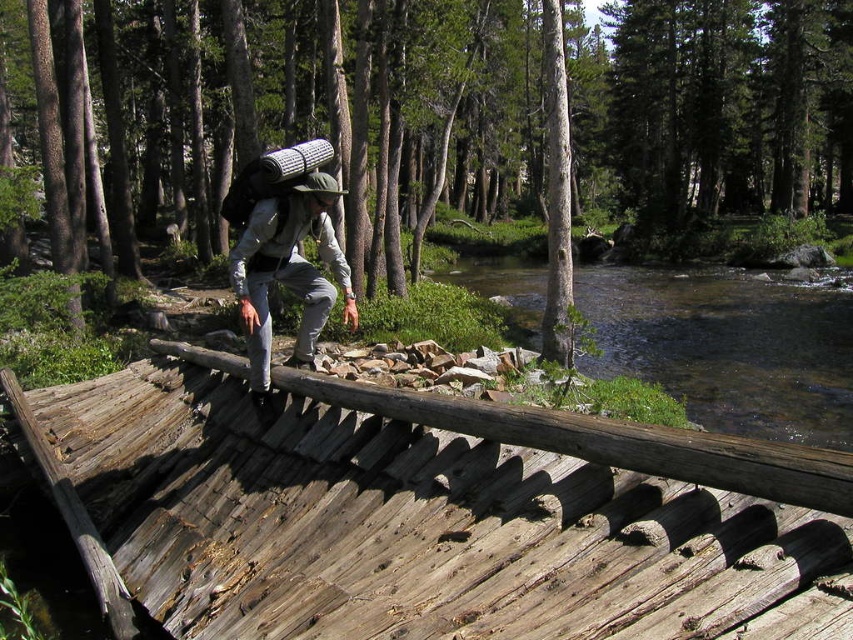
Question: Among these objects, which one is farthest from the camera?

Choices:
 (A) green matte forest at center
 (B) clear water at river right
 (C) gray fabric backpack at center
 (D) weathered wood bridge at center

Answer: (A)

Question: Which is nearer to the weathered wood bridge at center?

Choices:
 (A) gray fabric backpack at center
 (B) green matte forest at center
 (C) clear water at river right

Answer: (A)

Question: Where is weathered wood bridge at center located in relation to green matte forest at center in the image?

Choices:
 (A) below
 (B) above

Answer: (A)

Question: Which object appears farthest from the camera in this image?

Choices:
 (A) weathered wood bridge at center
 (B) clear water at river right

Answer: (B)

Question: From the image, what is the correct spatial relationship of clear water at river right in relation to gray fabric backpack at center?

Choices:
 (A) below
 (B) above

Answer: (B)

Question: Considering the relative positions of weathered wood bridge at center and gray fabric backpack at center in the image provided, where is weathered wood bridge at center located with respect to gray fabric backpack at center?

Choices:
 (A) above
 (B) below

Answer: (B)